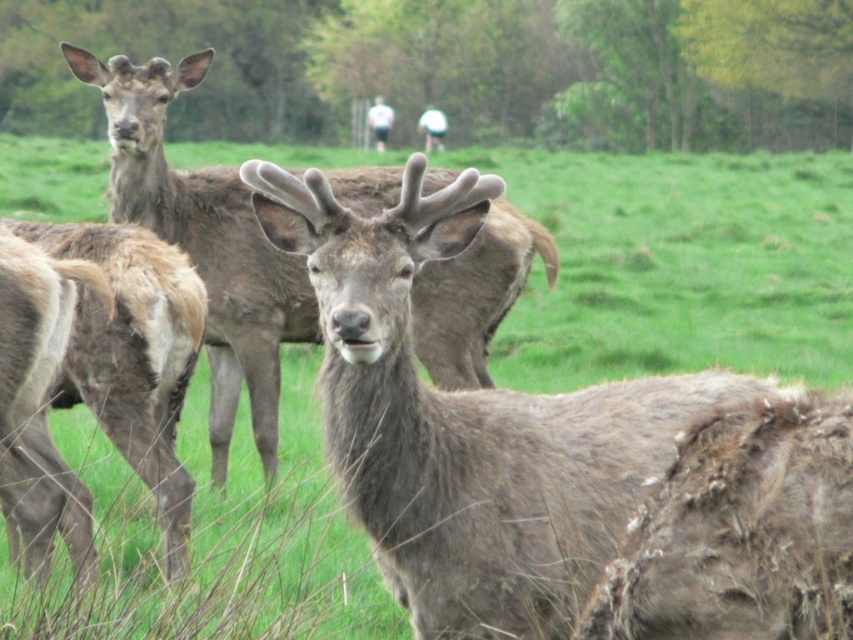
Is point (416, 563) closer to camera compared to point (103, 365)?

Yes.

Is point (436, 604) positioned behind point (201, 292)?

No, it is in front of (201, 292).

Which is behind, point (357, 497) or point (123, 413)?

Point (123, 413)

At what (x,y) coordinates should I click in order to perform the action: click on brown fur antlered deer at center. Please return your answer as a coordinate pair (x, y). This screenshot has width=853, height=640. Looking at the image, I should click on (465, 422).

Based on the photo, does brown fur antlered deer at center appear over gray fur deer at center?

No.

Does brown fur antlered deer at center appear on the left side of gray fur deer at center?

In fact, brown fur antlered deer at center is to the right of gray fur deer at center.

This screenshot has height=640, width=853. What do you see at coordinates (465, 422) in the screenshot? I see `brown fur antlered deer at center` at bounding box center [465, 422].

At what (x,y) coordinates should I click in order to perform the action: click on brown fur antlered deer at center. Please return your answer as a coordinate pair (x, y). Image resolution: width=853 pixels, height=640 pixels. Looking at the image, I should click on (465, 422).

Which is below, gray fur deer at center or brown fuzzy deer at center?

brown fuzzy deer at center is below.

This screenshot has width=853, height=640. In order to click on gray fur deer at center in this screenshot , I will do `click(206, 244)`.